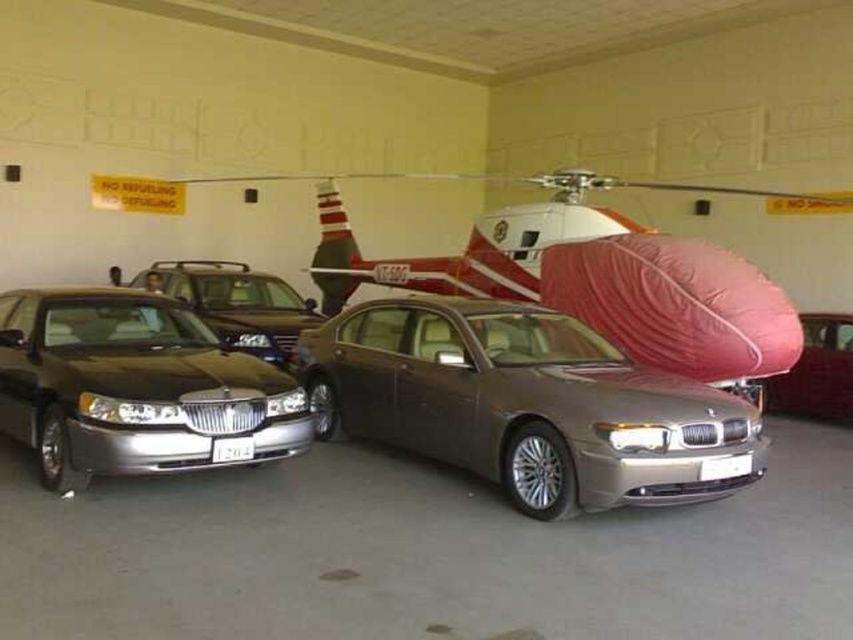
Question: Which object appears closest to the camera in this image?

Choices:
 (A) satin metallic sedan at center
 (B) satin black sedan at left
 (C) shiny silver sedan at center
 (D) red fabric-covered airplane at center

Answer: (A)

Question: Is satin black sedan at left bigger than shiny silver sedan at center?

Choices:
 (A) no
 (B) yes

Answer: (B)

Question: Where is satin metallic sedan at center located in relation to satin silver sedan at center in the image?

Choices:
 (A) below
 (B) above

Answer: (B)

Question: Estimate the real-world distances between objects in this image. Which object is farther from the satin metallic sedan at center?

Choices:
 (A) red fabric-covered airplane at center
 (B) satin silver sedan at center
 (C) shiny silver sedan at center

Answer: (B)

Question: Estimate the real-world distances between objects in this image. Which object is farther from the satin silver sedan at center?

Choices:
 (A) satin metallic sedan at center
 (B) shiny silver sedan at center
 (C) red fabric-covered airplane at center

Answer: (B)

Question: Does red fabric-covered airplane at center lie in front of satin silver sedan at center?

Choices:
 (A) yes
 (B) no

Answer: (A)